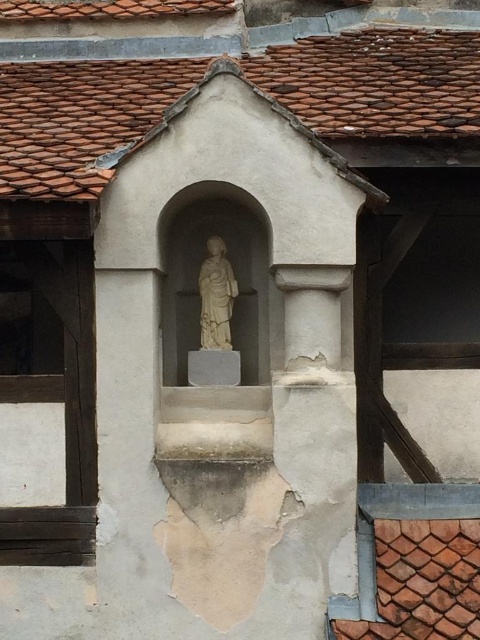
Question: Which is nearer to the wooden window at left?

Choices:
 (A) brown clay tiles at upper center
 (B) white stone statue at center

Answer: (B)

Question: Which point appears closest to the camera in this image?

Choices:
 (A) (48, 448)
 (B) (235, 268)
 (C) (50, 141)

Answer: (A)

Question: Does brown clay tiles at upper center have a lesser width compared to wooden window at left?

Choices:
 (A) yes
 (B) no

Answer: (B)

Question: Does white stone statue at center have a lesser width compared to white marble statue at center?

Choices:
 (A) no
 (B) yes

Answer: (A)

Question: Considering the relative positions of white stone statue at center and white marble statue at center in the image provided, where is white stone statue at center located with respect to white marble statue at center?

Choices:
 (A) right
 (B) left

Answer: (B)

Question: Which of these objects is positioned farthest from the brown clay tiles at upper center?

Choices:
 (A) white marble statue at center
 (B) white stone statue at center
 (C) wooden window at left

Answer: (C)